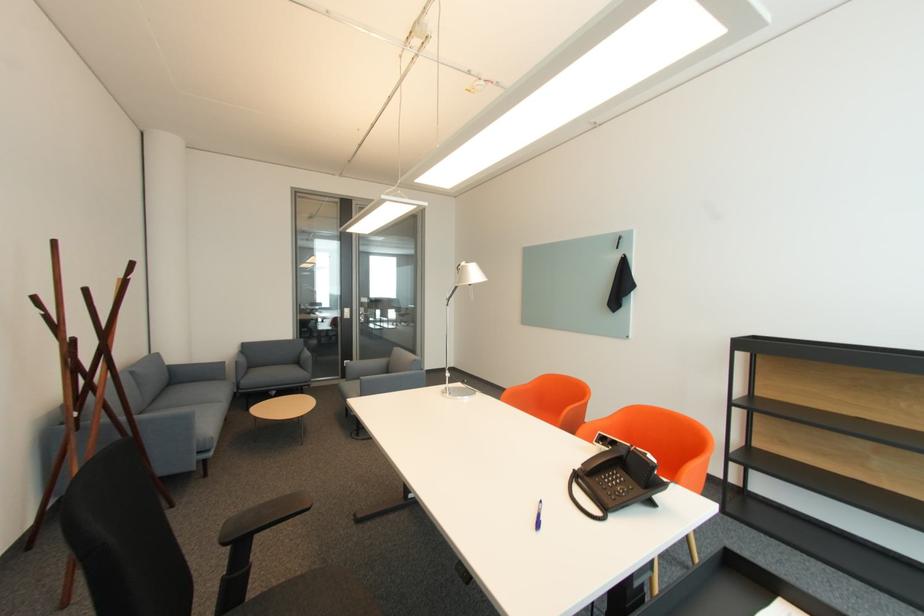
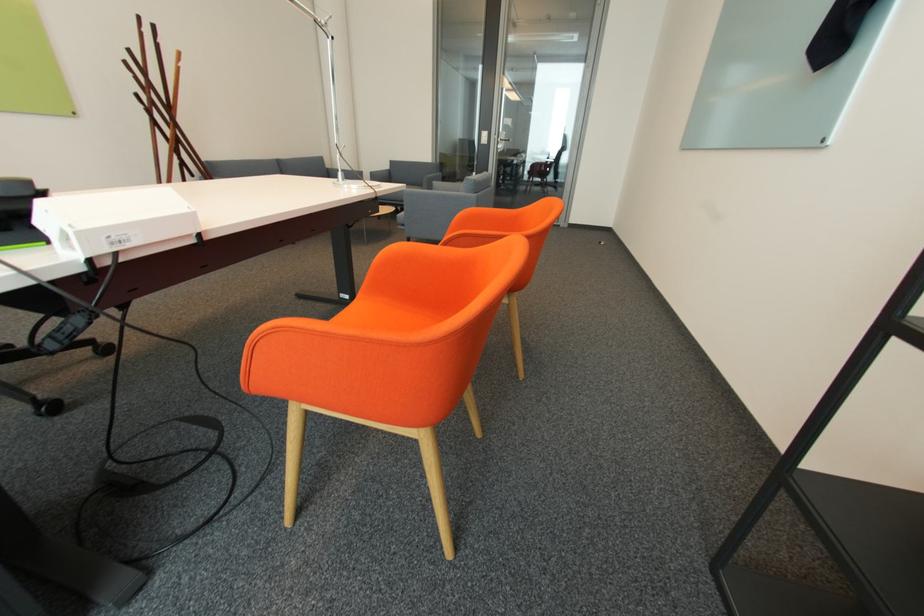
Question: I am providing you with two images of the same scene from different viewpoints. Which of the following objects are not visible in image2?

Choices:
 (A) white wire hanger
 (B) sofa sitting surface
 (C) sofa armrest
 (D) orange chair sitting surface

Answer: (B)